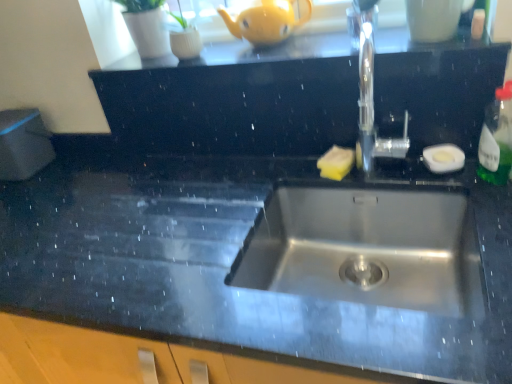
Question: Should I look upward or downward to see black granite dresser at center?

Choices:
 (A) up
 (B) down

Answer: (A)

Question: Is green translucent bottle at right aimed at white glossy mug at upper center?

Choices:
 (A) yes
 (B) no

Answer: (B)

Question: Does green translucent bottle at right appear on the left side of white glossy mug at upper center?

Choices:
 (A) yes
 (B) no

Answer: (B)

Question: Can you confirm if green translucent bottle at right is taller than white glossy mug at upper center?

Choices:
 (A) no
 (B) yes

Answer: (B)

Question: Considering the relative sizes of green translucent bottle at right and white glossy mug at upper center in the image provided, is green translucent bottle at right thinner than white glossy mug at upper center?

Choices:
 (A) no
 (B) yes

Answer: (B)

Question: Considering the relative sizes of green translucent bottle at right and white glossy mug at upper center in the image provided, is green translucent bottle at right shorter than white glossy mug at upper center?

Choices:
 (A) no
 (B) yes

Answer: (A)

Question: Considering the relative positions of green translucent bottle at right and white glossy mug at upper center in the image provided, is green translucent bottle at right to the right of white glossy mug at upper center from the viewer's perspective?

Choices:
 (A) no
 (B) yes

Answer: (B)

Question: Is black granite dresser at center bigger than polished stainless steel tap at upper center?

Choices:
 (A) yes
 (B) no

Answer: (A)

Question: Can you confirm if black granite dresser at center is thinner than polished stainless steel tap at upper center?

Choices:
 (A) no
 (B) yes

Answer: (A)

Question: From the image's perspective, does black granite dresser at center appear higher than polished stainless steel tap at upper center?

Choices:
 (A) yes
 (B) no

Answer: (A)

Question: From a real-world perspective, does black granite dresser at center sit lower than polished stainless steel tap at upper center?

Choices:
 (A) yes
 (B) no

Answer: (A)

Question: Is black granite dresser at center turned away from polished stainless steel tap at upper center?

Choices:
 (A) no
 (B) yes

Answer: (A)

Question: Can you confirm if black granite dresser at center is wider than polished stainless steel tap at upper center?

Choices:
 (A) yes
 (B) no

Answer: (A)

Question: From the image's perspective, is white glossy mug at upper center over polished stainless steel tap at upper center?

Choices:
 (A) yes
 (B) no

Answer: (A)